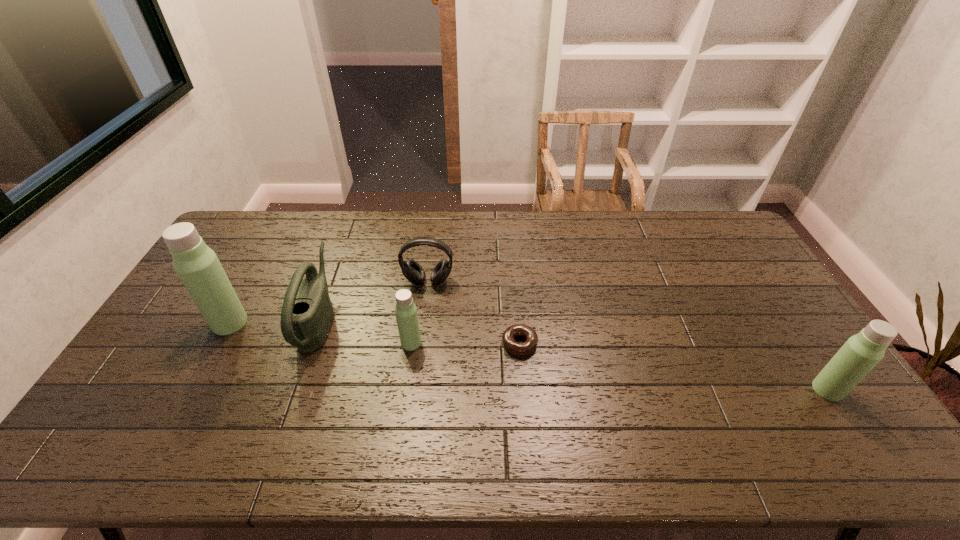
To make them evenly spaced by inserting another thermos_bottle among them, please locate a vacant spot for this new thermos_bottle. Please provide its 2D coordinates. Your answer should be formatted as a tuple, i.e. [(x, y)], where the tuple contains the x and y coordinates of a point satisfying the conditions above.

[(610, 365)]